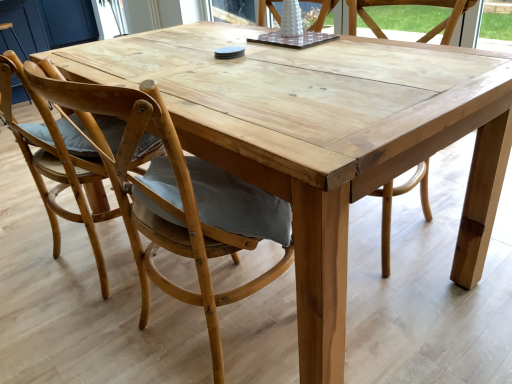
Question: In the image, is white matte vase at upper center, which is the second chair in right-to-left order, on the left side or the right side of light brown wood chair at left, acting as the 1th chair starting from the left?

Choices:
 (A) right
 (B) left

Answer: (A)

Question: From the image's perspective, is white matte vase at upper center, which is the second chair in right-to-left order, positioned above or below light brown wood chair at left, which ranks as the fourth chair in right-to-left order?

Choices:
 (A) below
 (B) above

Answer: (B)

Question: Which is nearer to the natural wood chair at center, placed as the second chair when sorted from left to right?

Choices:
 (A) white matte vase at upper center, which is the second chair in right-to-left order
 (B) light brown wood chair at left, which ranks as the fourth chair in right-to-left order
 (C) natural wood chair at center, which is counted as the 1th chair, starting from the right

Answer: (B)

Question: Estimate the real-world distances between objects in this image. Which object is closer to the white matte vase at upper center, the 3th chair when ordered from left to right?

Choices:
 (A) natural wood chair at center, the third chair in the right-to-left sequence
 (B) natural wood chair at center, which ranks as the 4th chair in left-to-right order
 (C) light brown wood chair at left, which ranks as the fourth chair in right-to-left order

Answer: (B)